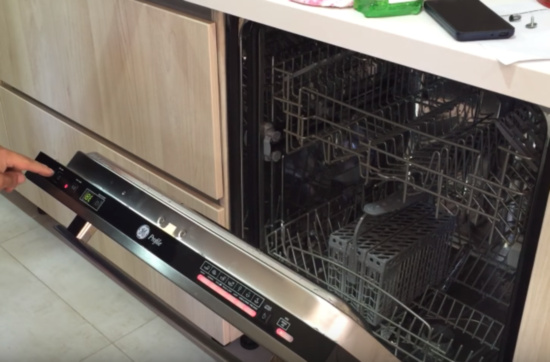
You are a GUI agent. You are given a task and a screenshot of the screen. Output one action in this format:
    pyautogui.click(x=<x>, y=<y>)
    Task: Click on the bottom dishwasher rack
    
    Given the screenshot: What is the action you would take?
    pyautogui.click(x=316, y=255)